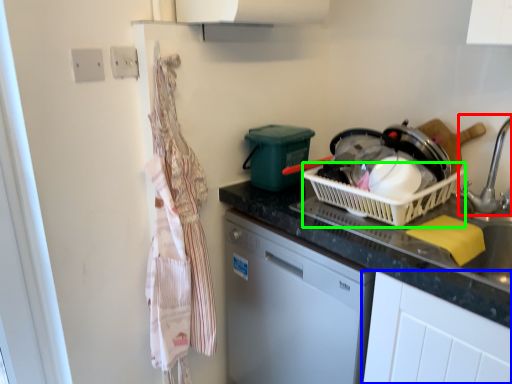
Question: Based on their relative distances, which object is farther from faucet (highlighted by a red box)? Choose from cabinetry (highlighted by a blue box) and basket (highlighted by a green box).

Choices:
 (A) cabinetry
 (B) basket

Answer: (A)